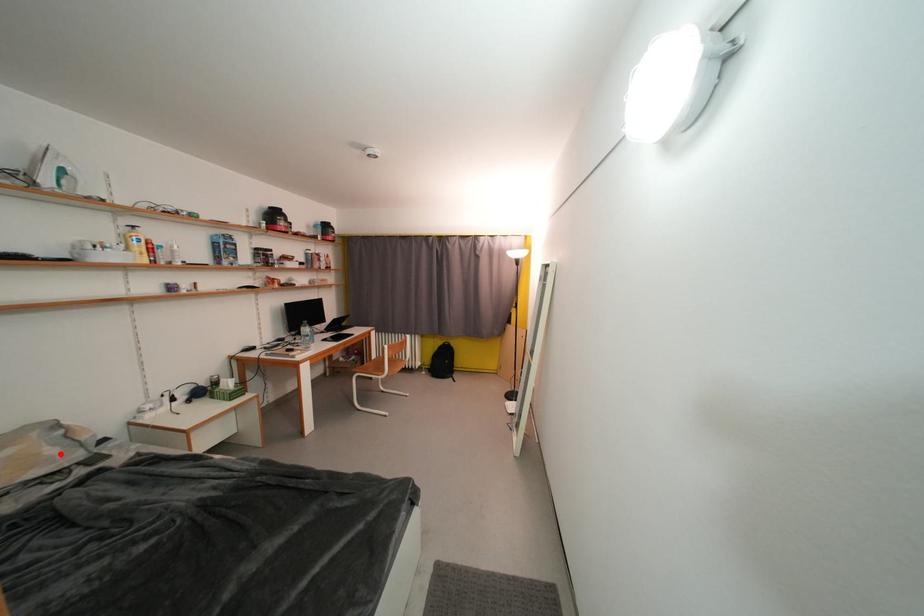
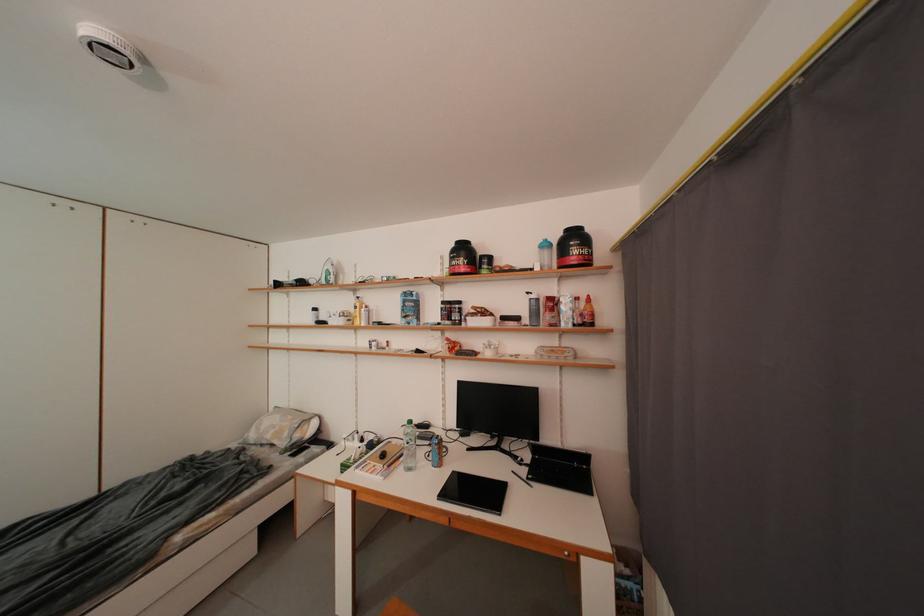
Question: I am providing you with two images of the same scene from different viewpoints. In image1, a red point is highlighted. Considering the same 3D point in image2, which of the following is correct?

Choices:
 (A) It is closer
 (B) It is farther

Answer: (B)